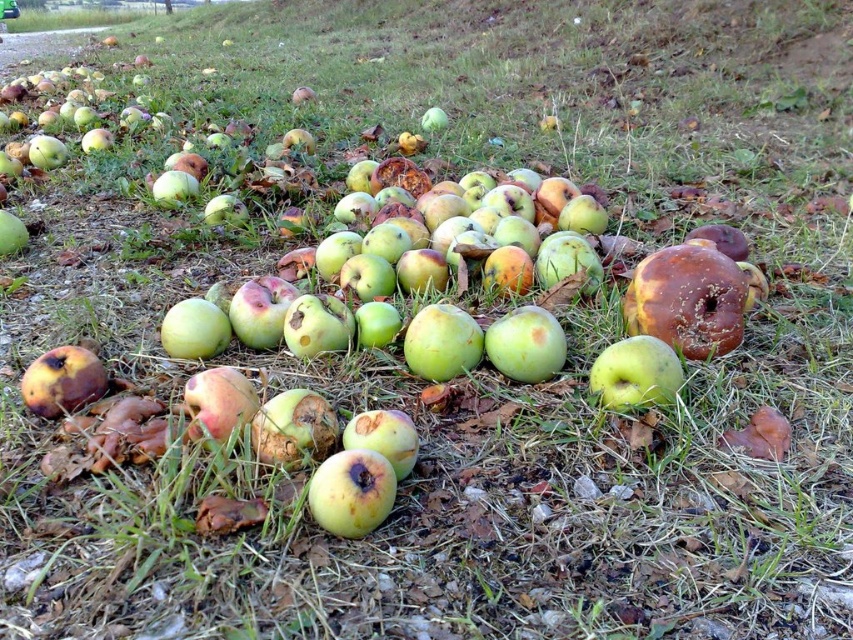
You are a gardener who wants to collect all the apples in the scene. You are currently standing at the green matte apple at center. Can you reach the rotten green apple at lower left without moving your feet?

The distance between the green matte apple at center and the rotten green apple at lower left is 1.11 meters. Since the gardener cannot reach that far without moving their feet, they would need to take a step to collect the rotten green apple at lower left.

Consider the image. You are standing at the point with coordinates point (636, 372) and want to find the green matte apple at center. According to the scene description, where exactly are you located?

You are located at the green matte apple at center because the point (636, 372) corresponds to it.